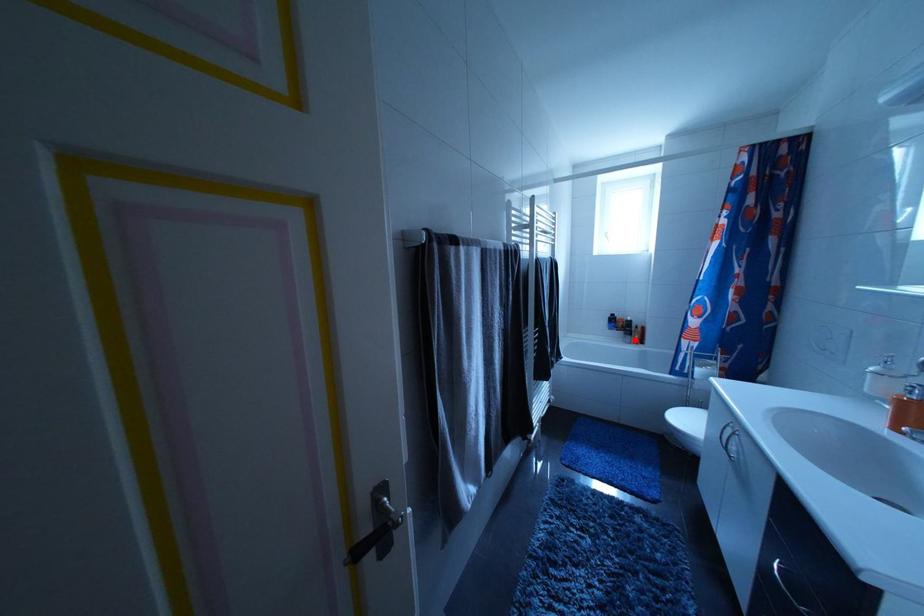
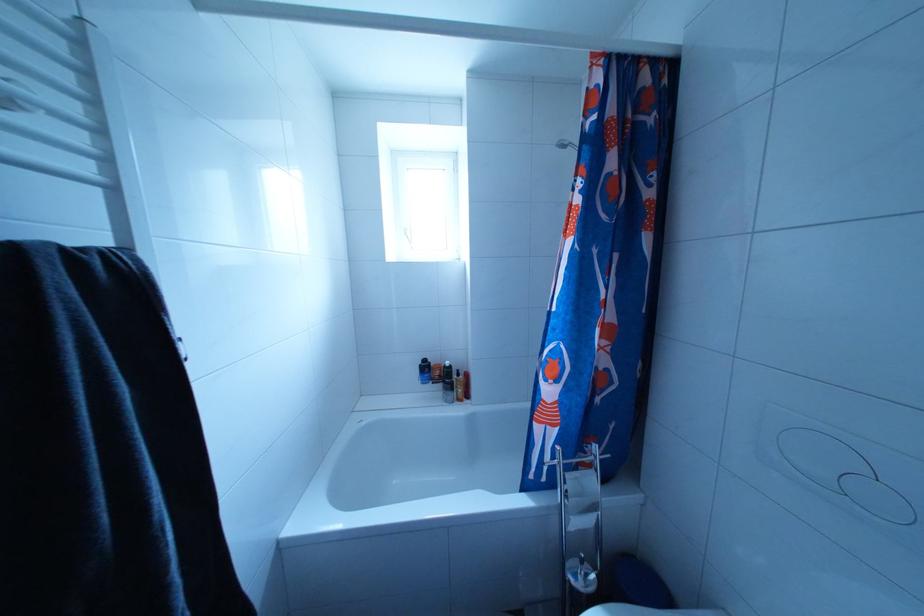
Question: I am providing you with two images of the same scene from different viewpoints. A red point is shown in image1. For the corresponding object point in image2, is it positioned nearer or farther from the camera?

Choices:
 (A) Nearer
 (B) Farther

Answer: (B)